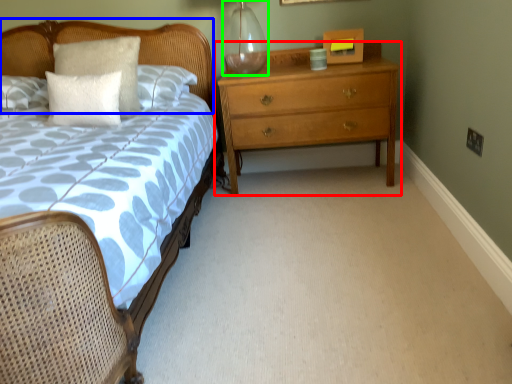
Question: Which object is positioned closest to chest of drawers (highlighted by a red box)? Select from headboard (highlighted by a blue box) and glass vase (highlighted by a green box).

Choices:
 (A) headboard
 (B) glass vase

Answer: (B)